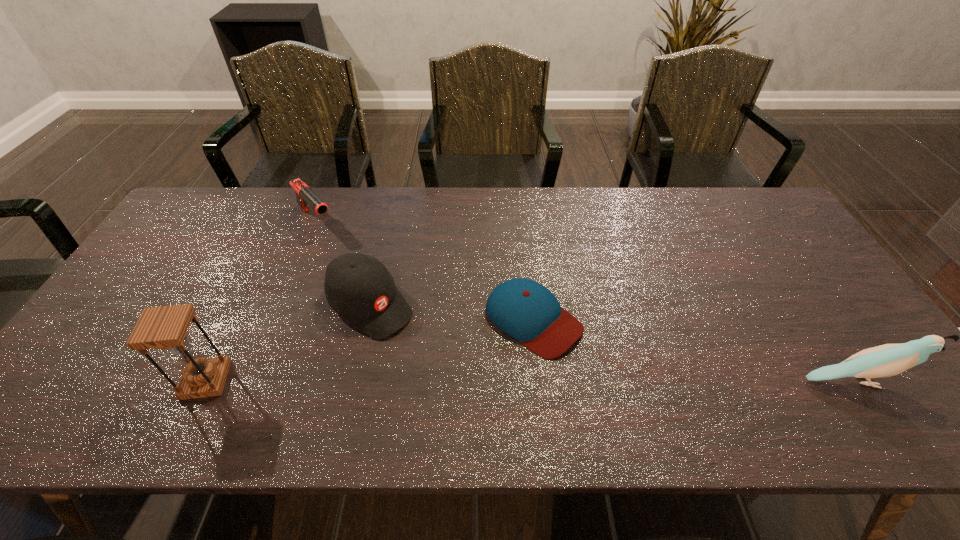
Where is `vacant spot on the desktop that is between the hourglass and the bird and is positioned with a logo on the front of the third object from left to right`? vacant spot on the desktop that is between the hourglass and the bird and is positioned with a logo on the front of the third object from left to right is located at coordinates (459, 381).

Where is `free space on the desktop that is between the hourglass and the bird and is positioned at the aiming end of the gun`? free space on the desktop that is between the hourglass and the bird and is positioned at the aiming end of the gun is located at coordinates (467, 381).

Where is `vacant spot on the desktop that is between the tallest object and the bird and is positioned with the bill of the right baseball cap facing forward`? vacant spot on the desktop that is between the tallest object and the bird and is positioned with the bill of the right baseball cap facing forward is located at coordinates (618, 381).